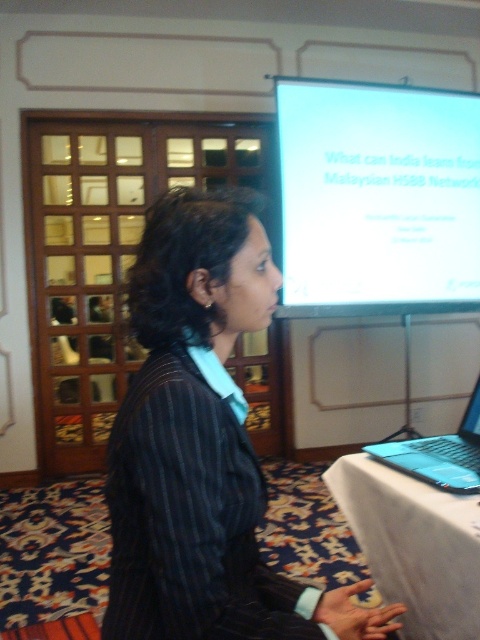
Does dark pinstripe blazer at center appear under white cloth at lower right?

Actually, dark pinstripe blazer at center is above white cloth at lower right.

Measure the distance between point (116, 568) and camera.

Point (116, 568) and camera are 36.24 inches apart.

Where is `dark pinstripe blazer at center`? The image size is (480, 640). dark pinstripe blazer at center is located at coordinates (203, 445).

At what (x,y) coordinates should I click in order to perform the action: click on dark pinstripe blazer at center. Please return your answer as a coordinate pair (x, y). Looking at the image, I should click on (203, 445).

Describe the element at coordinates (203, 445) in the screenshot. The image size is (480, 640). I see `dark pinstripe blazer at center` at that location.

Is point (367, 586) positioned behind point (304, 108)?

No.

Where is `dark pinstripe blazer at center`? This screenshot has height=640, width=480. dark pinstripe blazer at center is located at coordinates (203, 445).

Is white matte projection screen at upper center behind white cloth at lower right?

Yes, white matte projection screen at upper center is behind white cloth at lower right.

Which is more to the left, white matte projection screen at upper center or white cloth at lower right?

white cloth at lower right is more to the left.

What are the coordinates of `white matte projection screen at upper center` in the screenshot? It's located at (377, 198).